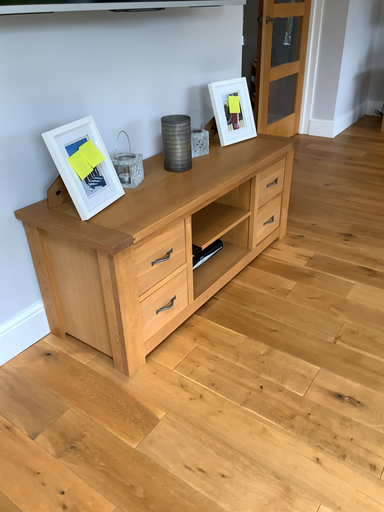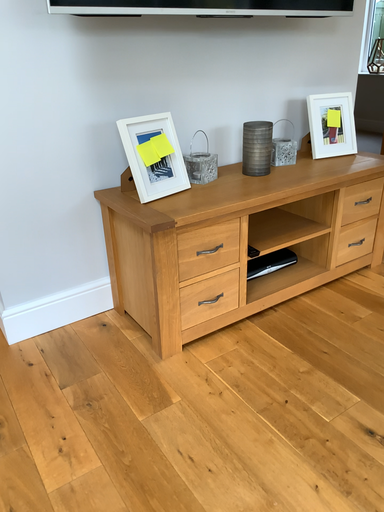
Question: How did the camera likely rotate when shooting the video?

Choices:
 (A) rotated right
 (B) rotated left

Answer: (B)